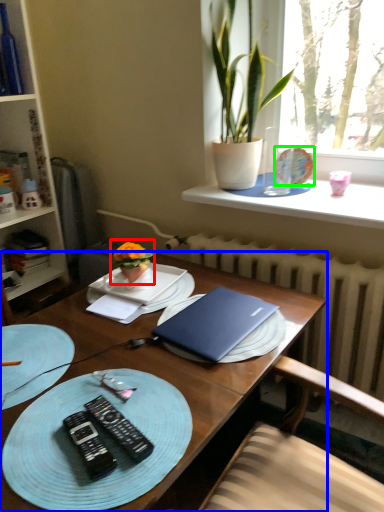
Question: Based on their relative distances, which object is farther from houseplant (highlighted by a red box)? Choose from desk (highlighted by a blue box) and tableware (highlighted by a green box).

Choices:
 (A) desk
 (B) tableware

Answer: (B)